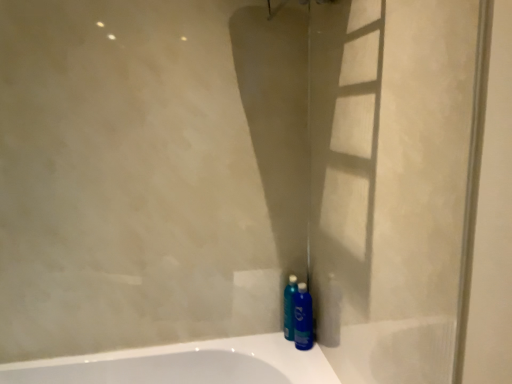
What is the approximate height of blue glossy bottle at lower right?

9.93 inches.

The width and height of the screenshot is (512, 384). Describe the element at coordinates (303, 318) in the screenshot. I see `blue glossy bottle at lower right` at that location.

Where is `blue glossy bottle at lower right`? The image size is (512, 384). blue glossy bottle at lower right is located at coordinates (303, 318).

Image resolution: width=512 pixels, height=384 pixels. What do you see at coordinates (289, 307) in the screenshot? I see `metallic blue spray bottle at lower right` at bounding box center [289, 307].

The image size is (512, 384). I want to click on metallic blue spray bottle at lower right, so click(x=289, y=307).

Where is `blue glossy bottle at lower right`? The width and height of the screenshot is (512, 384). blue glossy bottle at lower right is located at coordinates (303, 318).

Is blue glossy bottle at lower right to the right of metallic blue spray bottle at lower right from the viewer's perspective?

Correct, you'll find blue glossy bottle at lower right to the right of metallic blue spray bottle at lower right.

Which object is further away from the camera, blue glossy bottle at lower right or metallic blue spray bottle at lower right?

metallic blue spray bottle at lower right.

Which point is more forward, (305, 302) or (287, 332)?

The point (305, 302) is closer.

From the image's perspective, is blue glossy bottle at lower right above or below metallic blue spray bottle at lower right?

blue glossy bottle at lower right is situated lower than metallic blue spray bottle at lower right in the image.

From a real-world perspective, between blue glossy bottle at lower right and metallic blue spray bottle at lower right, who is vertically lower?

blue glossy bottle at lower right is physically lower.

Considering the relative sizes of blue glossy bottle at lower right and metallic blue spray bottle at lower right in the image provided, is blue glossy bottle at lower right thinner than metallic blue spray bottle at lower right?

No.

Is blue glossy bottle at lower right taller or shorter than metallic blue spray bottle at lower right?

In the image, blue glossy bottle at lower right appears to be shorter than metallic blue spray bottle at lower right.

Who is bigger, blue glossy bottle at lower right or metallic blue spray bottle at lower right?

Bigger between the two is blue glossy bottle at lower right.

Does blue glossy bottle at lower right contain metallic blue spray bottle at lower right?

That's incorrect, metallic blue spray bottle at lower right is not inside blue glossy bottle at lower right.

Is blue glossy bottle at lower right next to metallic blue spray bottle at lower right and touching it?

Yes, blue glossy bottle at lower right is touching metallic blue spray bottle at lower right.

Is blue glossy bottle at lower right aimed at metallic blue spray bottle at lower right?

No, blue glossy bottle at lower right is not aimed at metallic blue spray bottle at lower right.

Consider the image. How many degrees apart are the facing directions of blue glossy bottle at lower right and metallic blue spray bottle at lower right?

They differ by 22.1 degrees in their facing directions.

Measure the distance from blue glossy bottle at lower right to metallic blue spray bottle at lower right.

blue glossy bottle at lower right and metallic blue spray bottle at lower right are 1.27 inches apart.

You are a GUI agent. You are given a task and a screenshot of the screen. Output one action in this format:
    pyautogui.click(x=<x>, y=<y>)
    Task: Click on the cleaning product on the left of blue glossy bottle at lower right
    
    Given the screenshot: What is the action you would take?
    pyautogui.click(x=289, y=307)

Is metallic blue spray bottle at lower right at the right side of blue glossy bottle at lower right?

Incorrect, metallic blue spray bottle at lower right is not on the right side of blue glossy bottle at lower right.

Is the position of metallic blue spray bottle at lower right more distant than that of blue glossy bottle at lower right?

Yes, metallic blue spray bottle at lower right is behind blue glossy bottle at lower right.

Is point (286, 286) farther from camera compared to point (298, 292)?

Yes.

From the image's perspective, between metallic blue spray bottle at lower right and blue glossy bottle at lower right, which one is located above?

From the image's view, metallic blue spray bottle at lower right is above.

From a real-world perspective, does metallic blue spray bottle at lower right stand above blue glossy bottle at lower right?

Indeed, from a real-world perspective, metallic blue spray bottle at lower right stands above blue glossy bottle at lower right.

In the scene shown: Can you confirm if metallic blue spray bottle at lower right is wider than blue glossy bottle at lower right?

Incorrect, the width of metallic blue spray bottle at lower right does not surpass that of blue glossy bottle at lower right.

Is metallic blue spray bottle at lower right taller or shorter than blue glossy bottle at lower right?

Considering their sizes, metallic blue spray bottle at lower right has more height than blue glossy bottle at lower right.

Can you confirm if metallic blue spray bottle at lower right is smaller than blue glossy bottle at lower right?

Yes, metallic blue spray bottle at lower right is smaller than blue glossy bottle at lower right.

Could blue glossy bottle at lower right be considered to be inside metallic blue spray bottle at lower right?

Definitely not — blue glossy bottle at lower right is not inside metallic blue spray bottle at lower right.

Is metallic blue spray bottle at lower right not close to blue glossy bottle at lower right?

No, metallic blue spray bottle at lower right is not far away from blue glossy bottle at lower right.

Does metallic blue spray bottle at lower right turn towards blue glossy bottle at lower right?

Yes, metallic blue spray bottle at lower right is oriented towards blue glossy bottle at lower right.

Measure the distance between metallic blue spray bottle at lower right and blue glossy bottle at lower right.

They are 1.27 inches apart.

The height and width of the screenshot is (384, 512). I want to click on mouthwash that is on the right side of metallic blue spray bottle at lower right, so click(303, 318).

Locate an element on the screen. Image resolution: width=512 pixels, height=384 pixels. mouthwash on the right of metallic blue spray bottle at lower right is located at coordinates (303, 318).

Where is `cleaning product behind the blue glossy bottle at lower right`? cleaning product behind the blue glossy bottle at lower right is located at coordinates (289, 307).